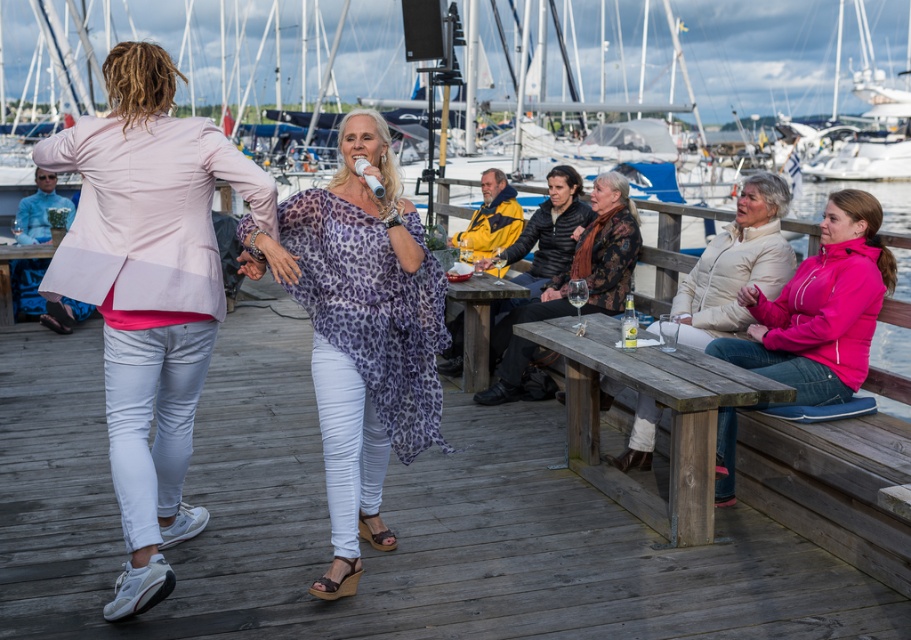
Question: Is leopard print fabric at center bigger than wooden picnic table at center?

Choices:
 (A) yes
 (B) no

Answer: (A)

Question: Which point is closer to the camera taking this photo?

Choices:
 (A) (203, 323)
 (B) (499, 545)
 (C) (722, 321)
 (D) (474, 346)

Answer: (A)

Question: Where is wooden deck at center located in relation to wooden picnic table at center in the image?

Choices:
 (A) below
 (B) above

Answer: (A)

Question: Which is nearer to the wooden deck at center?

Choices:
 (A) beige puffer jacket at lower right
 (B) leopard print fabric at center
 (C) wooden picnic table at lower right

Answer: (C)

Question: Does wooden deck at center come behind wooden picnic table at center?

Choices:
 (A) yes
 (B) no

Answer: (B)

Question: Which point appears farthest from the camera in this image?

Choices:
 (A) (362, 364)
 (B) (695, 388)

Answer: (B)